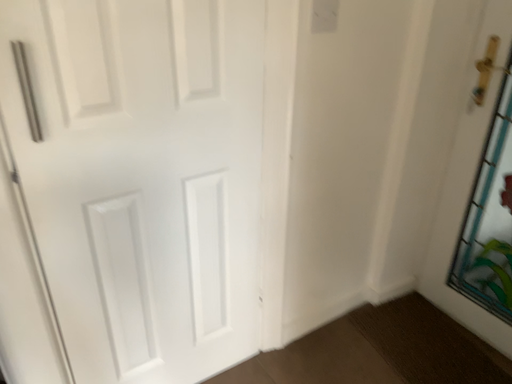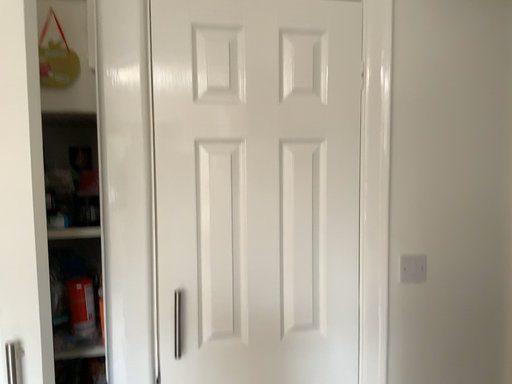
Question: Which way did the camera rotate in the video?

Choices:
 (A) rotated right
 (B) rotated left

Answer: (B)